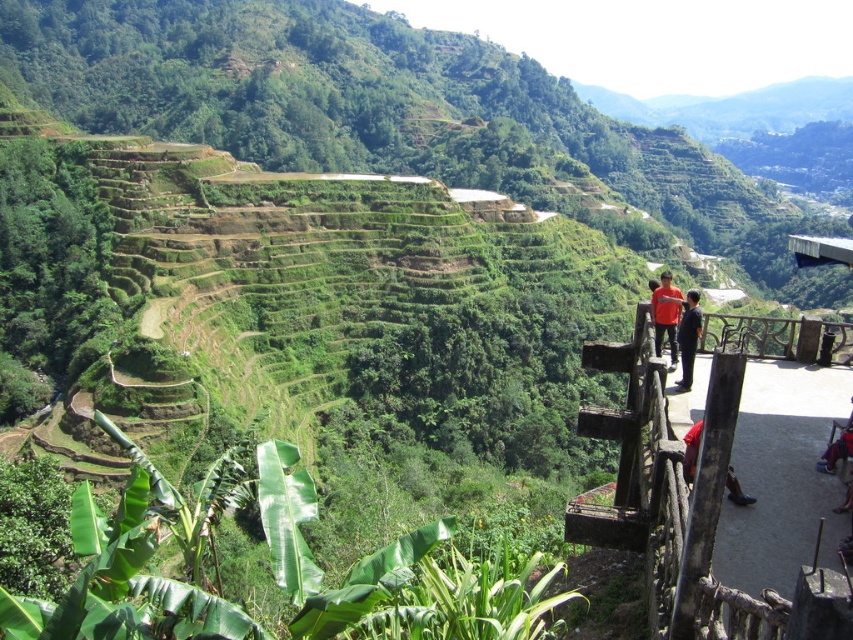
Question: From the image, what is the correct spatial relationship of orange shirt at center in relation to dark blue jeans at lower right?

Choices:
 (A) right
 (B) left

Answer: (B)

Question: Among these objects, which one is nearest to the camera?

Choices:
 (A) orange shirt at center
 (B) dark blue jeans at lower right
 (C) black smooth shirt at upper center
 (D) red matte pants at lower right

Answer: (D)

Question: Does black smooth shirt at upper center lie in front of dark blue jeans at lower right?

Choices:
 (A) yes
 (B) no

Answer: (B)

Question: Which object is farther from the camera taking this photo?

Choices:
 (A) orange shirt at center
 (B) dark blue jeans at lower right

Answer: (A)

Question: Which object is closer to the camera taking this photo?

Choices:
 (A) dark blue jeans at lower right
 (B) black smooth shirt at upper center

Answer: (A)

Question: Is red matte pants at lower right positioned in front of dark blue jeans at lower right?

Choices:
 (A) yes
 (B) no

Answer: (A)